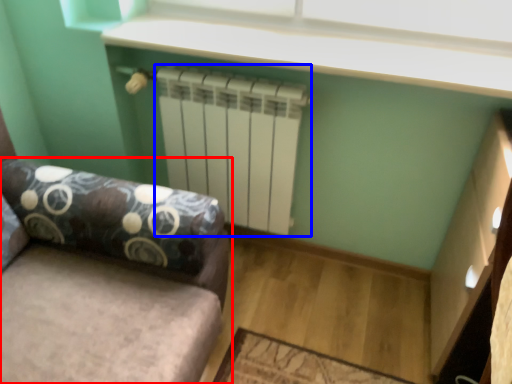
Question: Which of the following is the farthest to the observer, studio couch (highlighted by a red box) or radiator (highlighted by a blue box)?

Choices:
 (A) studio couch
 (B) radiator

Answer: (B)